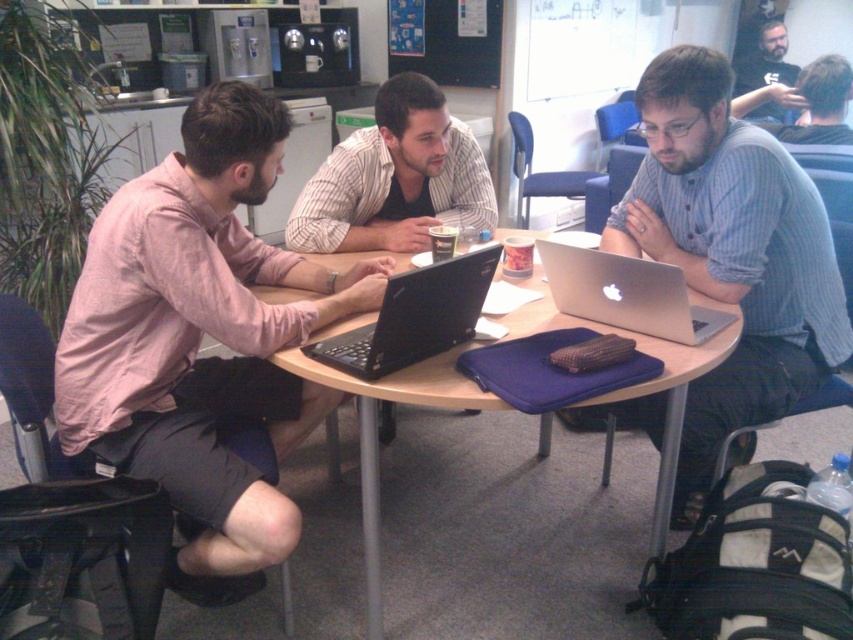
Question: Which object is positioned farthest from the silver metallic laptop at center?

Choices:
 (A) pink shirt at left
 (B) striped shirt at center
 (C) black matte shirt at upper right

Answer: (C)

Question: Which point is closer to the camera taking this photo?

Choices:
 (A) (219, 410)
 (B) (654, 529)
 (C) (778, 35)

Answer: (A)

Question: Is matte black laptop at center wider than silver metallic laptop at center?

Choices:
 (A) yes
 (B) no

Answer: (A)

Question: Is blue striped shirt at center further to camera compared to black matte shirt at upper right?

Choices:
 (A) yes
 (B) no

Answer: (B)

Question: Is blue striped shirt at center positioned before striped shirt at center?

Choices:
 (A) yes
 (B) no

Answer: (A)

Question: Which object is positioned closest to the silver metallic laptop at center?

Choices:
 (A) black matte laptop at center
 (B) blue striped shirt at center

Answer: (B)